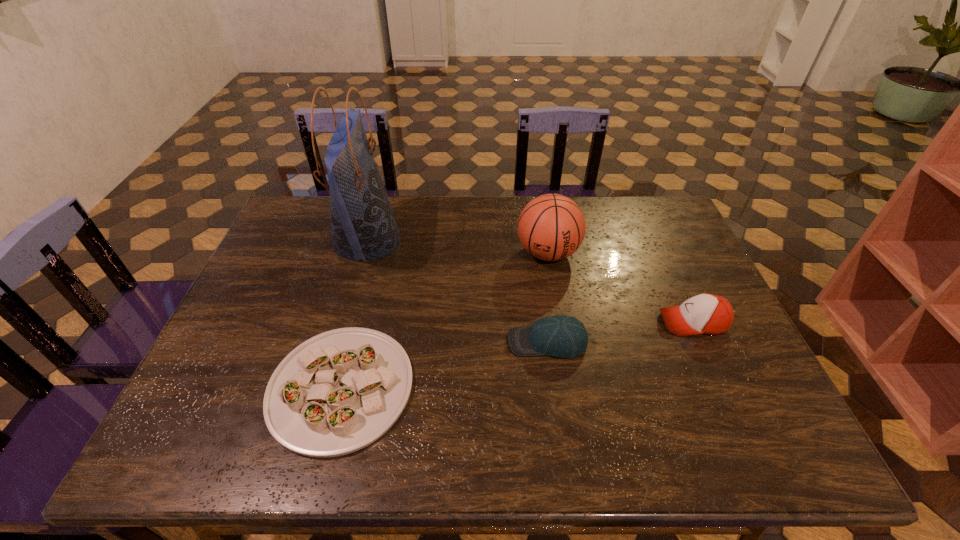
Image resolution: width=960 pixels, height=540 pixels. In the image, there is a desktop. Identify the location of free space at the left edge. (305, 248).

In order to click on free region at the right edge of the desktop in this screenshot , I will do tap(657, 240).

You are a GUI agent. You are given a task and a screenshot of the screen. Output one action in this format:
    pyautogui.click(x=<x>, y=<y>)
    Task: Click on the empty location between the shopping bag and the second tallest object
    The height and width of the screenshot is (540, 960).
    Given the screenshot: What is the action you would take?
    pyautogui.click(x=458, y=247)

Locate an element on the screen. free space between the left baseball cap and the basketball is located at coordinates (547, 298).

Find the location of a particular element. The width and height of the screenshot is (960, 540). free spot between the platter and the left baseball cap is located at coordinates point(444,365).

Locate an element on the screen. The width and height of the screenshot is (960, 540). unoccupied position between the second tallest object and the shorter baseball cap is located at coordinates (547, 298).

The image size is (960, 540). Find the location of `vacant space in between the shorter baseball cap and the tallest object`. vacant space in between the shorter baseball cap and the tallest object is located at coordinates (457, 291).

The height and width of the screenshot is (540, 960). Identify the location of free space between the shortest object and the left baseball cap. (444, 365).

Where is `unoccupied area between the tallest object and the second tallest object`? unoccupied area between the tallest object and the second tallest object is located at coordinates (458, 247).

This screenshot has width=960, height=540. I want to click on free spot between the shorter baseball cap and the platter, so click(x=444, y=365).